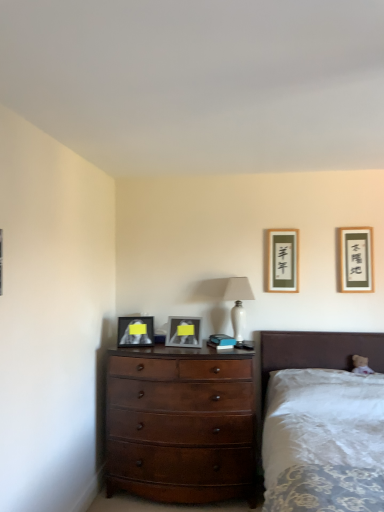
Question: From the image's perspective, is matte silver picture frame at center, acting as the 3th picture frame starting from the right, located beneath white glossy table lamp at center?

Choices:
 (A) yes
 (B) no

Answer: (A)

Question: Does matte silver picture frame at center, acting as the 3th picture frame starting from the right, have a lesser width compared to white glossy table lamp at center?

Choices:
 (A) yes
 (B) no

Answer: (A)

Question: Considering the relative sizes of matte silver picture frame at center, the 2th picture frame when ordered from left to right, and white glossy table lamp at center in the image provided, is matte silver picture frame at center, the 2th picture frame when ordered from left to right, smaller than white glossy table lamp at center?

Choices:
 (A) no
 (B) yes

Answer: (B)

Question: From a real-world perspective, does matte silver picture frame at center, the 2th picture frame when ordered from left to right, sit lower than white glossy table lamp at center?

Choices:
 (A) no
 (B) yes

Answer: (B)

Question: Could you tell me if matte silver picture frame at center, acting as the 3th picture frame starting from the right, is turned towards white glossy table lamp at center?

Choices:
 (A) yes
 (B) no

Answer: (B)

Question: From their relative heights in the image, would you say white fabric bed at lower right is taller or shorter than matte silver picture frame at center, the 2th picture frame when ordered from left to right?

Choices:
 (A) short
 (B) tall

Answer: (B)

Question: Is white fabric bed at lower right to the left or to the right of matte silver picture frame at center, the 2th picture frame when ordered from left to right, in the image?

Choices:
 (A) right
 (B) left

Answer: (A)

Question: In terms of width, does white fabric bed at lower right look wider or thinner when compared to matte silver picture frame at center, acting as the 3th picture frame starting from the right?

Choices:
 (A) thin
 (B) wide

Answer: (B)

Question: From the image's perspective, is white fabric bed at lower right positioned above or below matte silver picture frame at center, the 2th picture frame when ordered from left to right?

Choices:
 (A) above
 (B) below

Answer: (B)

Question: Considering the positions of point (349, 282) and point (182, 333), is point (349, 282) closer or farther from the camera than point (182, 333)?

Choices:
 (A) closer
 (B) farther

Answer: (B)

Question: Considering the positions of matte black picture frame at upper right, which is the fourth picture frame from left to right, and matte silver picture frame at center, acting as the 3th picture frame starting from the right, in the image, is matte black picture frame at upper right, which is the fourth picture frame from left to right, taller or shorter than matte silver picture frame at center, acting as the 3th picture frame starting from the right,?

Choices:
 (A) short
 (B) tall

Answer: (B)

Question: From the image's perspective, is matte black picture frame at upper right, which is the fourth picture frame from left to right, positioned above or below matte silver picture frame at center, the 2th picture frame when ordered from left to right?

Choices:
 (A) above
 (B) below

Answer: (A)

Question: Is matte black picture frame at upper right, marked as the 1th picture frame in a right-to-left arrangement, in front of or behind matte silver picture frame at center, acting as the 3th picture frame starting from the right, in the image?

Choices:
 (A) front
 (B) behind

Answer: (B)

Question: Would you say mahogany wood dresser at center is inside or outside white glossy table lamp at center?

Choices:
 (A) inside
 (B) outside

Answer: (B)

Question: Considering the positions of mahogany wood dresser at center and white glossy table lamp at center in the image, is mahogany wood dresser at center taller or shorter than white glossy table lamp at center?

Choices:
 (A) short
 (B) tall

Answer: (B)